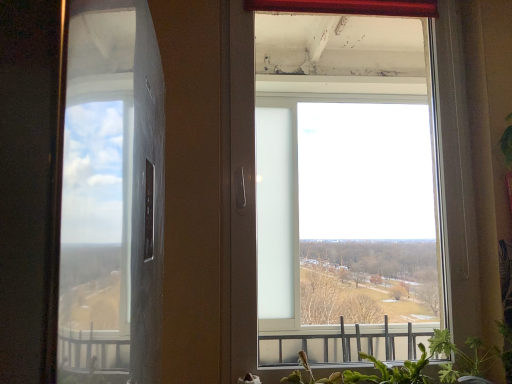
Question: From a real-world perspective, is green leafy plant at lower right, acting as the 2th plant starting from the right, beneath transparent glass window at center?

Choices:
 (A) yes
 (B) no

Answer: (A)

Question: Does green leafy plant at lower right, placed as the 1th plant when sorted from left to right, have a greater width compared to transparent glass window at center?

Choices:
 (A) no
 (B) yes

Answer: (B)

Question: From the image's perspective, is green leafy plant at lower right, placed as the 1th plant when sorted from left to right, located above transparent glass window at center?

Choices:
 (A) no
 (B) yes

Answer: (A)

Question: Is transparent glass window at center at the back of green leafy plant at lower right, acting as the 2th plant starting from the right?

Choices:
 (A) yes
 (B) no

Answer: (A)

Question: Is green leafy plant at lower right, placed as the 1th plant when sorted from left to right, smaller than transparent glass window at center?

Choices:
 (A) yes
 (B) no

Answer: (A)

Question: Is green leafy plant at lower right, arranged as the 1th plant when viewed from the right, in front of or behind green leafy plant at lower right, acting as the 2th plant starting from the right, in the image?

Choices:
 (A) behind
 (B) front

Answer: (B)

Question: Visually, is green leafy plant at lower right, arranged as the 1th plant when viewed from the right, positioned to the left or to the right of green leafy plant at lower right, acting as the 2th plant starting from the right?

Choices:
 (A) left
 (B) right

Answer: (B)

Question: Is point (504, 342) positioned closer to the camera than point (404, 364)?

Choices:
 (A) farther
 (B) closer

Answer: (B)

Question: From a real-world perspective, is green leafy plant at lower right, arranged as the 1th plant when viewed from the right, positioned above or below green leafy plant at lower right, placed as the 1th plant when sorted from left to right?

Choices:
 (A) above
 (B) below

Answer: (A)

Question: Do you think green leafy plant at lower right, which is counted as the second plant, starting from the left, is within transparent glass window at center, or outside of it?

Choices:
 (A) outside
 (B) inside

Answer: (A)

Question: Considering their positions, is green leafy plant at lower right, arranged as the 1th plant when viewed from the right, located in front of or behind transparent glass window at center?

Choices:
 (A) behind
 (B) front

Answer: (B)

Question: Visually, is green leafy plant at lower right, which is counted as the second plant, starting from the left, positioned to the left or to the right of transparent glass window at center?

Choices:
 (A) right
 (B) left

Answer: (A)

Question: In terms of size, does green leafy plant at lower right, which is counted as the second plant, starting from the left, appear bigger or smaller than transparent glass window at center?

Choices:
 (A) small
 (B) big

Answer: (A)

Question: From a real-world perspective, relative to green leafy plant at lower right, acting as the 2th plant starting from the right, is transparent glass window at center vertically above or below?

Choices:
 (A) below
 (B) above

Answer: (B)

Question: From the image's perspective, is transparent glass window at center above or below green leafy plant at lower right, placed as the 1th plant when sorted from left to right?

Choices:
 (A) above
 (B) below

Answer: (A)